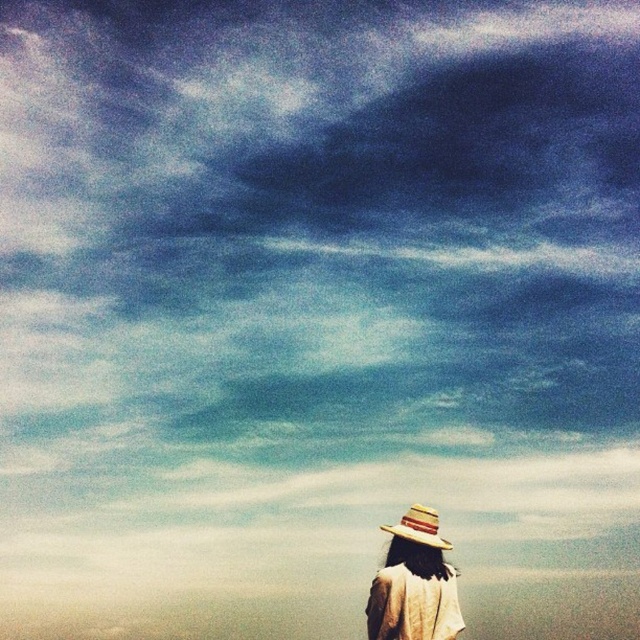
You are standing in the scene and see the point marked at coordinates (x=413, y=582). What object does this point correspond to?

The point at coordinates (x=413, y=582) corresponds to the straw hat at lower center.